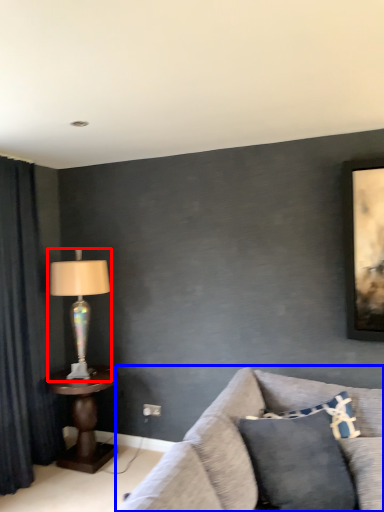
Question: Which of the following is the farthest to the observer, lamp (highlighted by a red box) or studio couch (highlighted by a blue box)?

Choices:
 (A) lamp
 (B) studio couch

Answer: (A)